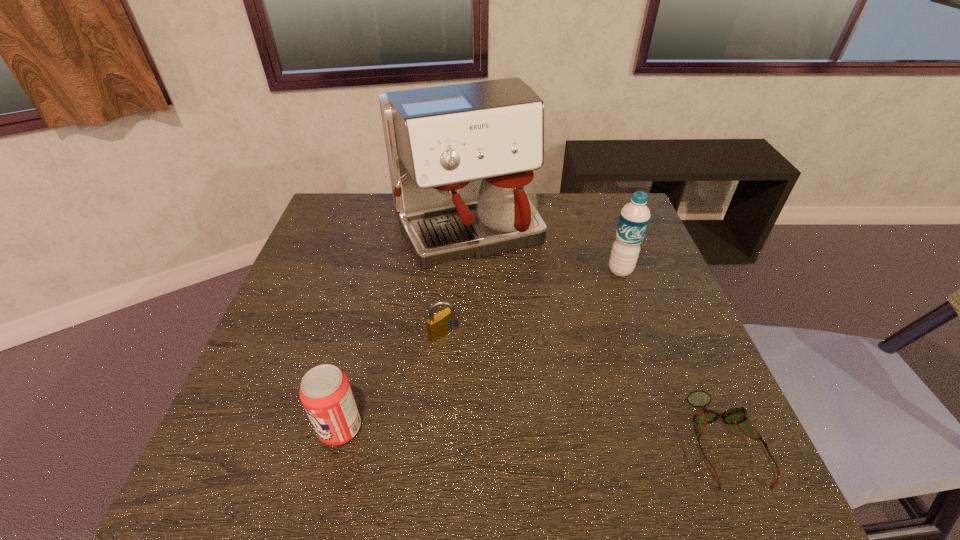
Find the location of a particular element. The height and width of the screenshot is (540, 960). vacant area that lies between the second shortest object and the soda can is located at coordinates (392, 381).

Find the location of `the second closest object to the tallest object`. the second closest object to the tallest object is located at coordinates [x=634, y=217].

Identify which object is the closest to the water bottle. Please provide its 2D coordinates. Your answer should be formatted as a tuple, i.e. [(x, y)], where the tuple contains the x and y coordinates of a point satisfying the conditions above.

[(461, 157)]

Locate an element on the screen. The width and height of the screenshot is (960, 540). vacant region that satisfies the following two spatial constraints: 1. on the front side of the tallest object; 2. on the left side of the water bottle is located at coordinates (466, 271).